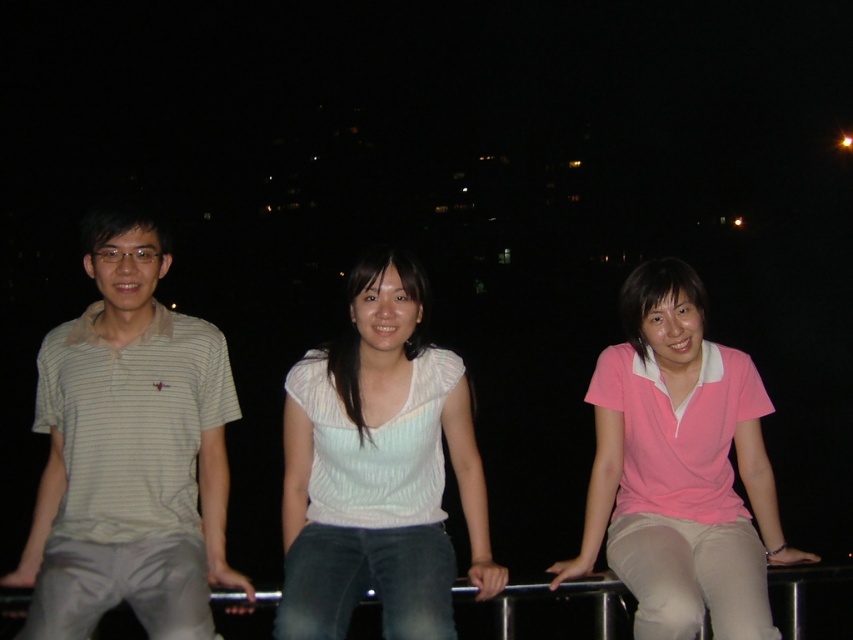
Between white matte shirt at center and pink matte shirt at center, which one is positioned higher?

white matte shirt at center

What do you see at coordinates (378, 468) in the screenshot? This screenshot has width=853, height=640. I see `white matte shirt at center` at bounding box center [378, 468].

Where is `white matte shirt at center`? Image resolution: width=853 pixels, height=640 pixels. white matte shirt at center is located at coordinates (378, 468).

Is white striped shirt at left above pink matte shirt at center?

Yes.

Can you confirm if white striped shirt at left is wider than pink matte shirt at center?

No, white striped shirt at left is not wider than pink matte shirt at center.

Is point (77, 525) positioned before point (622, 536)?

That is True.

Locate an element on the screen. The height and width of the screenshot is (640, 853). white striped shirt at left is located at coordinates (129, 452).

Who is lower down, white striped shirt at left or white matte shirt at center?

white matte shirt at center

Which is in front, point (109, 422) or point (345, 371)?

Point (109, 422) is more forward.

Identify the location of white striped shirt at left. This screenshot has width=853, height=640. (129, 452).